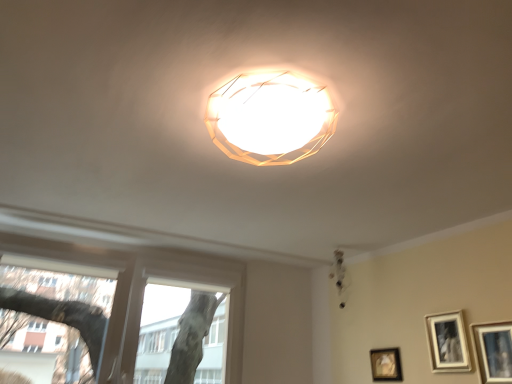
Question: Is matte black picture frame at lower right, the first picture frame positioned from the right, in front of or behind matte white chandelier at upper center in the image?

Choices:
 (A) front
 (B) behind

Answer: (A)

Question: Is matte black picture frame at lower right, which is the 3th picture frame in back-to-front order, bigger or smaller than matte white chandelier at upper center?

Choices:
 (A) small
 (B) big

Answer: (A)

Question: Estimate the real-world distances between objects in this image. Which object is closer to the matte silver picture frame at lower right, which is counted as the 2th picture frame, starting from the front?

Choices:
 (A) matte black picture frame at lower right, arranged as the 3th picture frame when viewed from the left
 (B) matte black picture frame at lower right, which appears as the 1th picture frame when viewed from the back
 (C) transparent glass window at lower left
 (D) matte white chandelier at upper center

Answer: (A)

Question: Estimate the real-world distances between objects in this image. Which object is closer to the matte silver picture frame at lower right, the 2th picture frame when ordered from left to right?

Choices:
 (A) matte white chandelier at upper center
 (B) transparent glass window at lower left
 (C) matte black picture frame at lower right, the 3th picture frame from the front
 (D) matte black picture frame at lower right, which is the 3th picture frame in back-to-front order

Answer: (D)